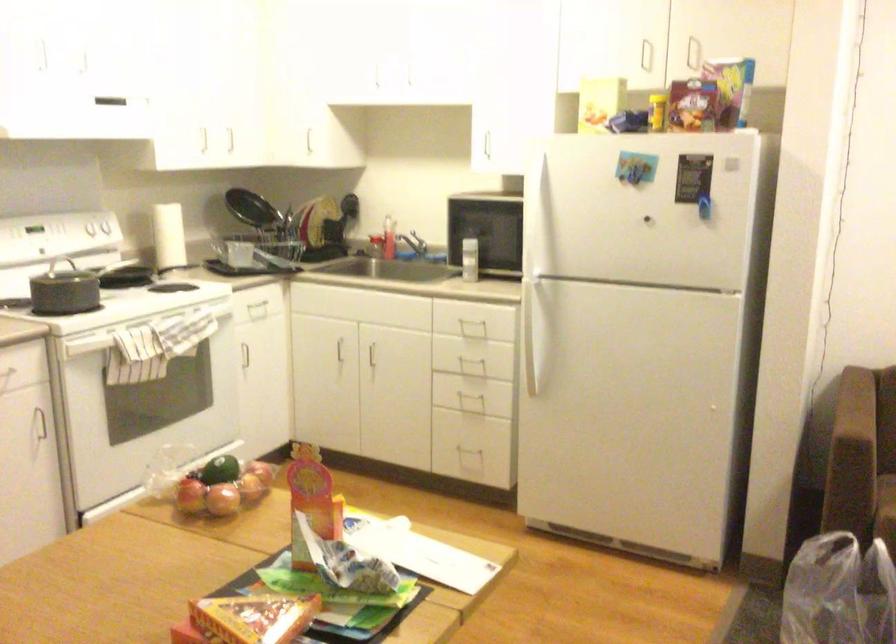
Find the location of a particular element. The height and width of the screenshot is (644, 896). red apple is located at coordinates (222, 500).